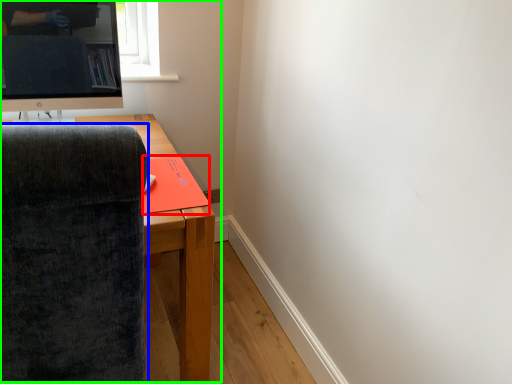
Question: Which is nearer to the book (highlighted by a red box)? chair (highlighted by a blue box) or entertainment center (highlighted by a green box).

Choices:
 (A) chair
 (B) entertainment center

Answer: (A)